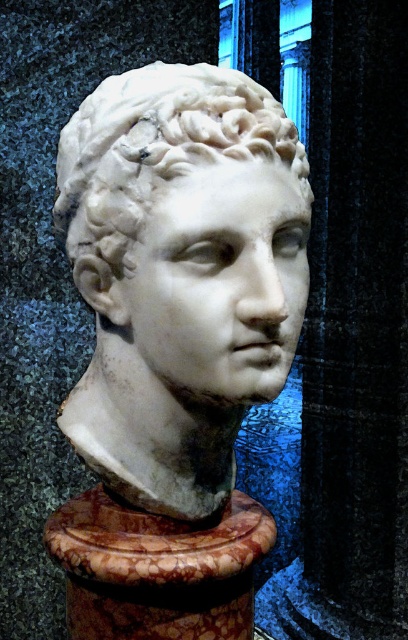
You are an art conservator examining the classical marble bust. You need to determine the placement of the white marble bust at center relative to the marble pedestal at center. Is the bust positioned above or below the pedestal?

The white marble bust at center is above the marble pedestal at center.

You are an art conservator examining the classical marble bust in the image. You need to determine the placement of the white marble bust at center relative to the marble pedestal at center. Is the bust positioned in front of or behind the pedestal?

The white marble bust at center is in front of the marble pedestal at center.

Based on the photo, you are an art conservator assessing the stability of the white marble bust at center and the marble pedestal at center. Given their sizes, which object might pose a higher risk of tipping over if disturbed?

The white marble bust at center is larger in size than the marble pedestal at center, so the bust is more likely to tip over due to its greater size and weight compared to the pedestal.